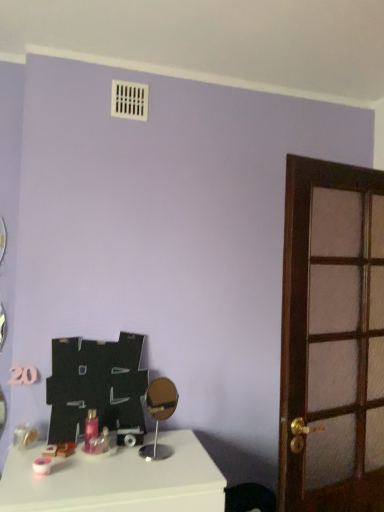
Question: From a real-world perspective, is brown wooden door at right below gold metallic mirror at center?

Choices:
 (A) yes
 (B) no

Answer: (B)

Question: Considering the relative sizes of brown wooden door at right and gold metallic mirror at center in the image provided, is brown wooden door at right wider than gold metallic mirror at center?

Choices:
 (A) yes
 (B) no

Answer: (B)

Question: Considering the relative sizes of brown wooden door at right and gold metallic mirror at center in the image provided, is brown wooden door at right taller than gold metallic mirror at center?

Choices:
 (A) no
 (B) yes

Answer: (B)

Question: From the image's perspective, is brown wooden door at right over gold metallic mirror at center?

Choices:
 (A) no
 (B) yes

Answer: (B)

Question: Does brown wooden door at right have a larger size compared to gold metallic mirror at center?

Choices:
 (A) yes
 (B) no

Answer: (A)

Question: From a real-world perspective, is pink glossy bottle at center above or below gold metallic mirror at center?

Choices:
 (A) above
 (B) below

Answer: (B)

Question: From the image's perspective, relative to gold metallic mirror at center, is pink glossy bottle at center above or below?

Choices:
 (A) below
 (B) above

Answer: (A)

Question: Would you say pink glossy bottle at center is to the left or to the right of gold metallic mirror at center in the picture?

Choices:
 (A) left
 (B) right

Answer: (A)

Question: In terms of size, does pink glossy bottle at center appear bigger or smaller than gold metallic mirror at center?

Choices:
 (A) small
 (B) big

Answer: (A)

Question: From the image's perspective, is brown wooden door at right positioned above or below white glossy table at lower left?

Choices:
 (A) above
 (B) below

Answer: (A)

Question: Would you say brown wooden door at right is inside or outside white glossy table at lower left?

Choices:
 (A) outside
 (B) inside

Answer: (A)

Question: From a real-world perspective, is brown wooden door at right physically located above or below white glossy table at lower left?

Choices:
 (A) above
 (B) below

Answer: (A)

Question: Considering the positions of brown wooden door at right and white glossy table at lower left in the image, is brown wooden door at right taller or shorter than white glossy table at lower left?

Choices:
 (A) tall
 (B) short

Answer: (A)

Question: In the image, is brown wooden door at right positioned in front of or behind gold metallic mirror at center?

Choices:
 (A) behind
 (B) front

Answer: (B)

Question: Based on their positions, is brown wooden door at right located to the left or right of gold metallic mirror at center?

Choices:
 (A) left
 (B) right

Answer: (B)